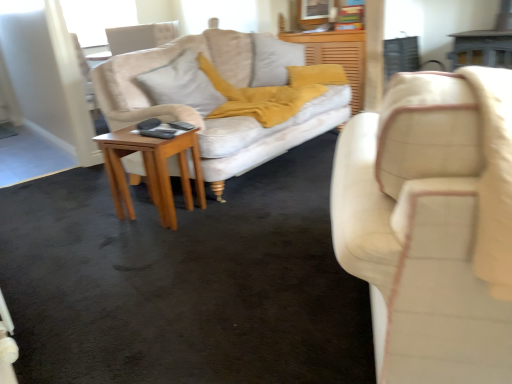
Identify the location of vacant area that lies in front of light brown wooden side table at center. This screenshot has height=384, width=512. (141, 244).